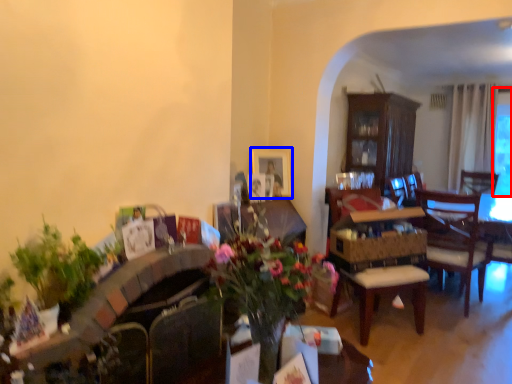
Question: Which object appears farthest to the camera in this image, window screen (highlighted by a red box) or picture frame (highlighted by a blue box)?

Choices:
 (A) window screen
 (B) picture frame

Answer: (A)